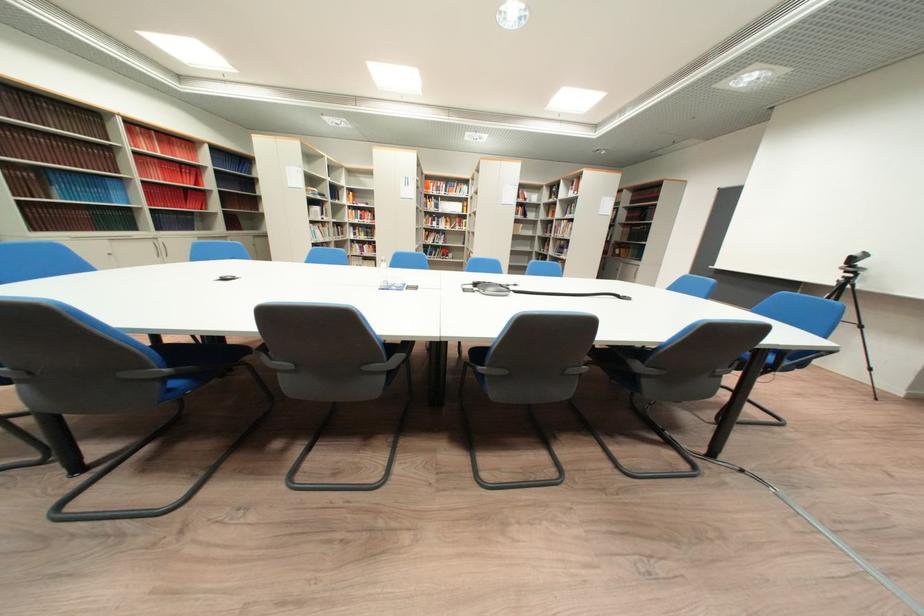
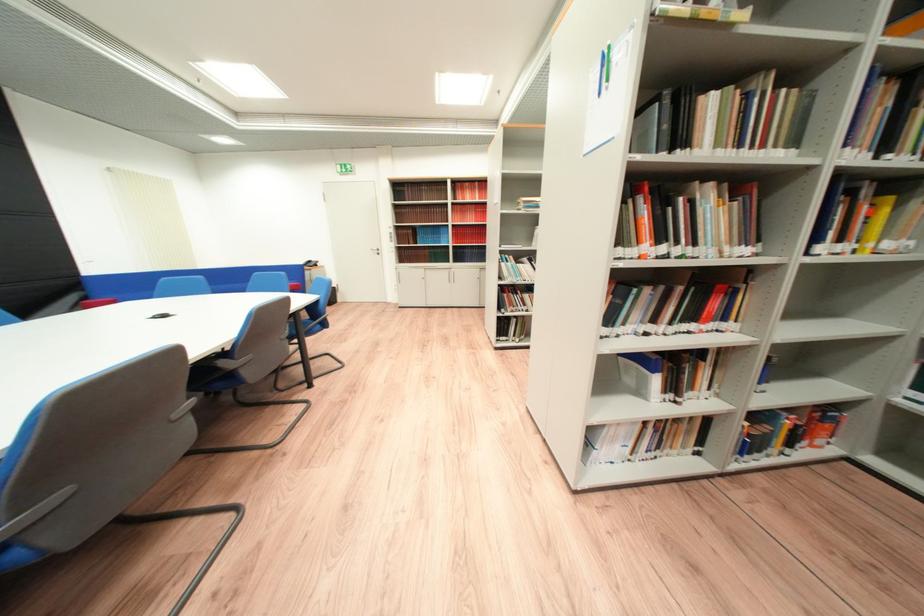
Question: I am providing you with two images of the same scene from different viewpoints. After the viewpoint changes to image2, which objects are now occluded?

Choices:
 (A) white telephone receiver
 (B) green pen
 (C) white door handle
 (D) blue chair sitting surface

Answer: (D)